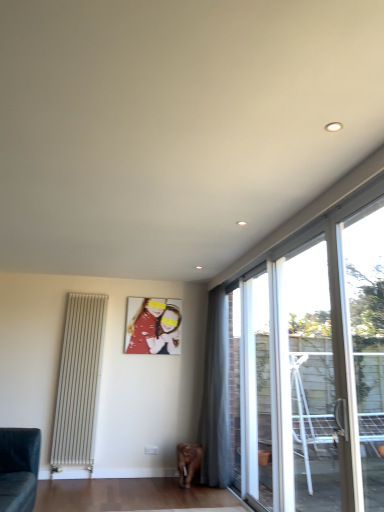
What is the approximate height of transparent glass door at upper right, arranged as the 1th window when viewed from the front?

The height of transparent glass door at upper right, arranged as the 1th window when viewed from the front, is 6.00 feet.

In order to face transparent glass door at right, which is the 2th window from front to back, should I rotate leftwards or rightwards?

A 14.210 degree turn to the right will do.

Describe the element at coordinates (312, 378) in the screenshot. I see `transparent glass door at right, which is the 2th window from front to back` at that location.

Describe the element at coordinates (235, 380) in the screenshot. This screenshot has width=384, height=512. I see `transparent glass window at right, which ranks as the first window in back-to-front order` at that location.

At what (x,y) coordinates should I click in order to perform the action: click on transparent glass window at right, which ranks as the first window in back-to-front order. Please return your answer as a coordinate pair (x, y). Looking at the image, I should click on (235, 380).

Where is `gray sheer curtain at right`? The image size is (384, 512). gray sheer curtain at right is located at coordinates (216, 396).

Locate an element on the screen. The image size is (384, 512). dark gray fabric couch at lower left is located at coordinates (18, 468).

Where is `transparent glass door at upper right, the third window from the back`? This screenshot has width=384, height=512. transparent glass door at upper right, the third window from the back is located at coordinates (364, 347).

Visually, is white metallic radiator at left positioned to the left or to the right of gray sheer curtain at right?

Clearly, white metallic radiator at left is on the left of gray sheer curtain at right in the image.

Can you confirm if white metallic radiator at left is wider than gray sheer curtain at right?

No.

In terms of size, does white metallic radiator at left appear bigger or smaller than gray sheer curtain at right?

Clearly, white metallic radiator at left is smaller in size than gray sheer curtain at right.

Could you tell me if transparent glass door at right, which is the 2th window from front to back, is turned towards dark gray fabric couch at lower left?

Yes, transparent glass door at right, which is the 2th window from front to back, is oriented towards dark gray fabric couch at lower left.

Do you think transparent glass door at right, which is the 2th window from back to front, is within dark gray fabric couch at lower left, or outside of it?

transparent glass door at right, which is the 2th window from back to front, is not inside dark gray fabric couch at lower left, it's outside.

How far apart are transparent glass door at right, which is the 2th window from front to back, and dark gray fabric couch at lower left?

transparent glass door at right, which is the 2th window from front to back, and dark gray fabric couch at lower left are 7.88 feet apart from each other.

Is there a large distance between transparent glass door at right, which is the 2th window from front to back, and dark gray fabric couch at lower left?

Yes, transparent glass door at right, which is the 2th window from front to back, and dark gray fabric couch at lower left are located far from each other.

Does point (236, 439) come in front of point (126, 317)?

Yes, point (236, 439) is closer to viewer.

Could you tell me if transparent glass window at right, which ranks as the third window in front-to-back order, is turned towards matte red photo frame at center?

No, transparent glass window at right, which ranks as the third window in front-to-back order, is not oriented towards matte red photo frame at center.

Between transparent glass window at right, which ranks as the third window in front-to-back order, and matte red photo frame at center, which one has less height?

With less height is matte red photo frame at center.

Between transparent glass window at right, which ranks as the first window in back-to-front order, and matte red photo frame at center, which one has smaller size?

Smaller between the two is matte red photo frame at center.

Which point is more distant from viewer, (374, 499) or (307, 358)?

Positioned behind is point (307, 358).

Is transparent glass door at upper right, the third window from the back, not near transparent glass door at right, which is the 2th window from back to front?

They are positioned close to each other.

Which is more to the right, transparent glass door at upper right, arranged as the 1th window when viewed from the front, or transparent glass door at right, which is the 2th window from front to back?

transparent glass door at upper right, arranged as the 1th window when viewed from the front, is more to the right.

Where is `the 1st window to the left of the transparent glass door at upper right, arranged as the 1th window when viewed from the front, counting from the anchor's position`? the 1st window to the left of the transparent glass door at upper right, arranged as the 1th window when viewed from the front, counting from the anchor's position is located at coordinates (312, 378).

Is white metallic radiator at left oriented towards dark gray fabric couch at lower left?

Yes.

Can you tell me how much white metallic radiator at left and dark gray fabric couch at lower left differ in facing direction?

88.5 degrees separate the facing orientations of white metallic radiator at left and dark gray fabric couch at lower left.

Would you say white metallic radiator at left contains dark gray fabric couch at lower left?

No, dark gray fabric couch at lower left is not surrounded by white metallic radiator at left.

Does white metallic radiator at left appear on the left side of dark gray fabric couch at lower left?

Incorrect, white metallic radiator at left is not on the left side of dark gray fabric couch at lower left.

Is the position of transparent glass door at upper right, arranged as the 1th window when viewed from the front, less distant than that of dark gray fabric couch at lower left?

Yes, transparent glass door at upper right, arranged as the 1th window when viewed from the front, is in front of dark gray fabric couch at lower left.

Considering the relative sizes of transparent glass door at upper right, arranged as the 1th window when viewed from the front, and dark gray fabric couch at lower left in the image provided, is transparent glass door at upper right, arranged as the 1th window when viewed from the front, taller than dark gray fabric couch at lower left?

Yes, transparent glass door at upper right, arranged as the 1th window when viewed from the front, is taller than dark gray fabric couch at lower left.

Does transparent glass door at upper right, arranged as the 1th window when viewed from the front, have a greater width compared to dark gray fabric couch at lower left?

No, transparent glass door at upper right, arranged as the 1th window when viewed from the front, is not wider than dark gray fabric couch at lower left.

Which is nearer, (356,436) or (32,433)?

Point (356,436) is positioned closer to the camera compared to point (32,433).

From a real-world perspective, is transparent glass door at right, which is the 2th window from front to back, physically above transparent glass door at upper right, the third window from the back?

No, from a real-world perspective, transparent glass door at right, which is the 2th window from front to back, is not over transparent glass door at upper right, the third window from the back

From the image's perspective, which is above, transparent glass door at right, which is the 2th window from back to front, or transparent glass door at upper right, the third window from the back?

From the image's view, transparent glass door at upper right, the third window from the back, is above.

Between transparent glass door at right, which is the 2th window from back to front, and transparent glass door at upper right, the third window from the back, which one has smaller size?

With smaller size is transparent glass door at upper right, the third window from the back.

Is transparent glass door at right, which is the 2th window from back to front, oriented away from transparent glass door at upper right, arranged as the 1th window when viewed from the front?

No.

You are a GUI agent. You are given a task and a screenshot of the screen. Output one action in this format:
    pyautogui.click(x=<x>, y=<y>)
    Task: Click on the curtain above the white metallic radiator at left (from a real-world perspective)
    This screenshot has height=512, width=384.
    Given the screenshot: What is the action you would take?
    pyautogui.click(x=216, y=396)

The image size is (384, 512). Find the location of `studio couch in front of the transparent glass door at right, which is the 2th window from front to back`. studio couch in front of the transparent glass door at right, which is the 2th window from front to back is located at coordinates (18, 468).

Which object lies nearer to the anchor point transparent glass window at right, which ranks as the third window in front-to-back order, gray sheer curtain at right or transparent glass door at right, which is the 2th window from front to back?

gray sheer curtain at right is closer to transparent glass window at right, which ranks as the third window in front-to-back order.

When comparing their distances from white metallic radiator at left, does gray sheer curtain at right or transparent glass window at right, which ranks as the first window in back-to-front order, seem closer?

Among the two, gray sheer curtain at right is located nearer to white metallic radiator at left.

Looking at the image, which one is located further to transparent glass window at right, which ranks as the first window in back-to-front order, white metallic radiator at left or dark gray fabric couch at lower left?

The object further to transparent glass window at right, which ranks as the first window in back-to-front order, is dark gray fabric couch at lower left.

Considering their positions, is gray sheer curtain at right positioned further to dark gray fabric couch at lower left than matte red photo frame at center?

Based on the image, gray sheer curtain at right appears to be further to dark gray fabric couch at lower left.

Estimate the real-world distances between objects in this image. Which object is further from white metallic radiator at left, transparent glass window at right, which ranks as the third window in front-to-back order, or gray sheer curtain at right?

transparent glass window at right, which ranks as the third window in front-to-back order, is further to white metallic radiator at left.

Estimate the real-world distances between objects in this image. Which object is closer to matte red photo frame at center, dark gray fabric couch at lower left or transparent glass window at right, which ranks as the first window in back-to-front order?

transparent glass window at right, which ranks as the first window in back-to-front order, is closer to matte red photo frame at center.

Looking at the image, which one is located further to transparent glass door at right, which is the 2th window from back to front, dark gray fabric couch at lower left or matte red photo frame at center?

Based on the image, dark gray fabric couch at lower left appears to be further to transparent glass door at right, which is the 2th window from back to front.

From the image, which object appears to be nearer to white metallic radiator at left, matte red photo frame at center or gray sheer curtain at right?

matte red photo frame at center is closer to white metallic radiator at left.

This screenshot has width=384, height=512. Find the location of `art situated between white metallic radiator at left and transparent glass window at right, which ranks as the first window in back-to-front order, from left to right`. art situated between white metallic radiator at left and transparent glass window at right, which ranks as the first window in back-to-front order, from left to right is located at coordinates (153, 326).

The image size is (384, 512). Find the location of `studio couch between transparent glass door at upper right, arranged as the 1th window when viewed from the front, and matte red photo frame at center, along the z-axis`. studio couch between transparent glass door at upper right, arranged as the 1th window when viewed from the front, and matte red photo frame at center, along the z-axis is located at coordinates (18, 468).

At what (x,y) coordinates should I click in order to perform the action: click on curtain between transparent glass window at right, which ranks as the third window in front-to-back order, and matte red photo frame at center, along the z-axis. Please return your answer as a coordinate pair (x, y). The width and height of the screenshot is (384, 512). Looking at the image, I should click on (216, 396).

This screenshot has height=512, width=384. Find the location of `radiator between dark gray fabric couch at lower left and matte red photo frame at center in the front-back direction`. radiator between dark gray fabric couch at lower left and matte red photo frame at center in the front-back direction is located at coordinates (79, 382).